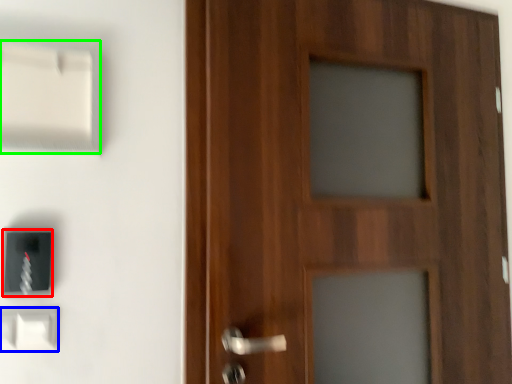
Question: Which object is the farthest from light switch (highlighted by a red box)? Choose among these: light switch (highlighted by a blue box) or light switch (highlighted by a green box).

Choices:
 (A) light switch
 (B) light switch

Answer: (B)